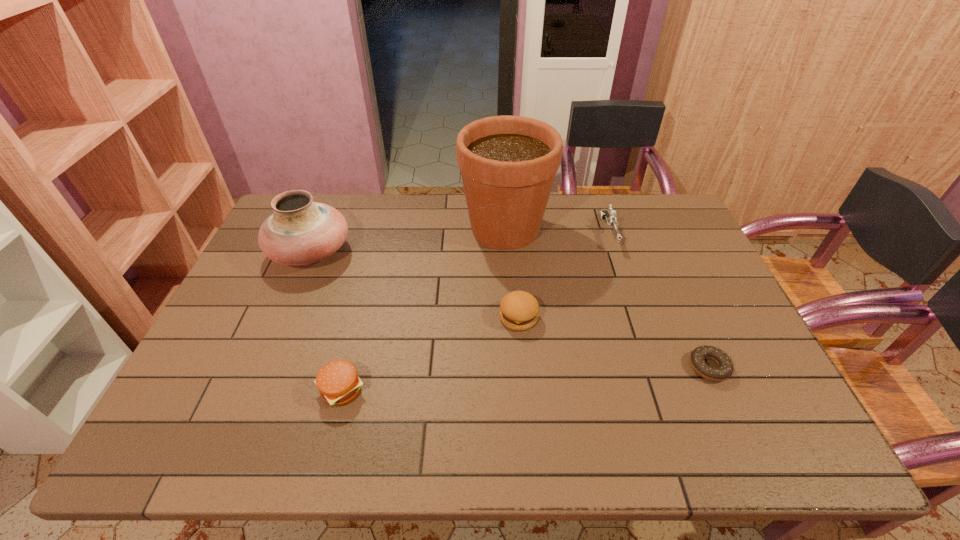
Locate an element on the screen. vacant region that satisfies the following two spatial constraints: 1. aimed along the barrel of the shortest object; 2. on the right side of the gun is located at coordinates (655, 367).